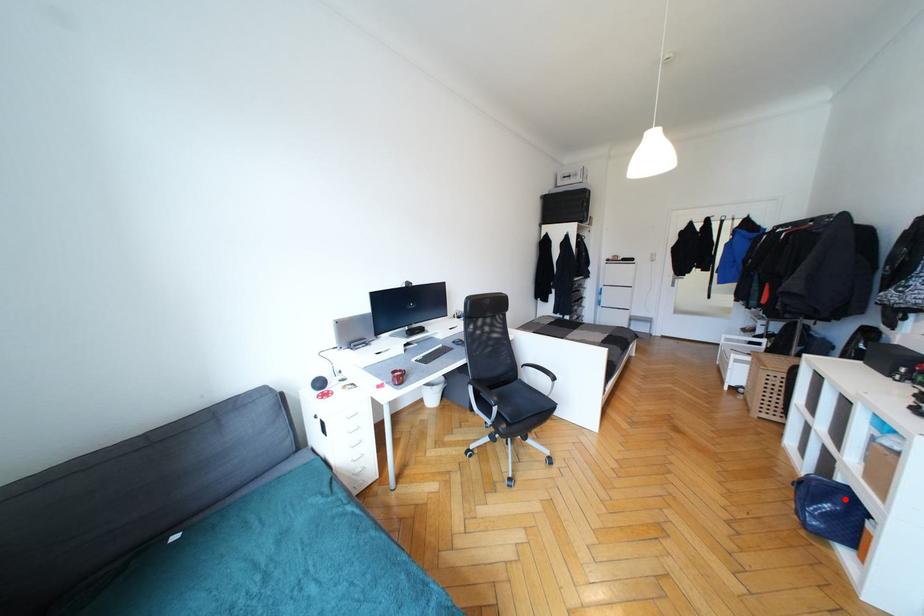
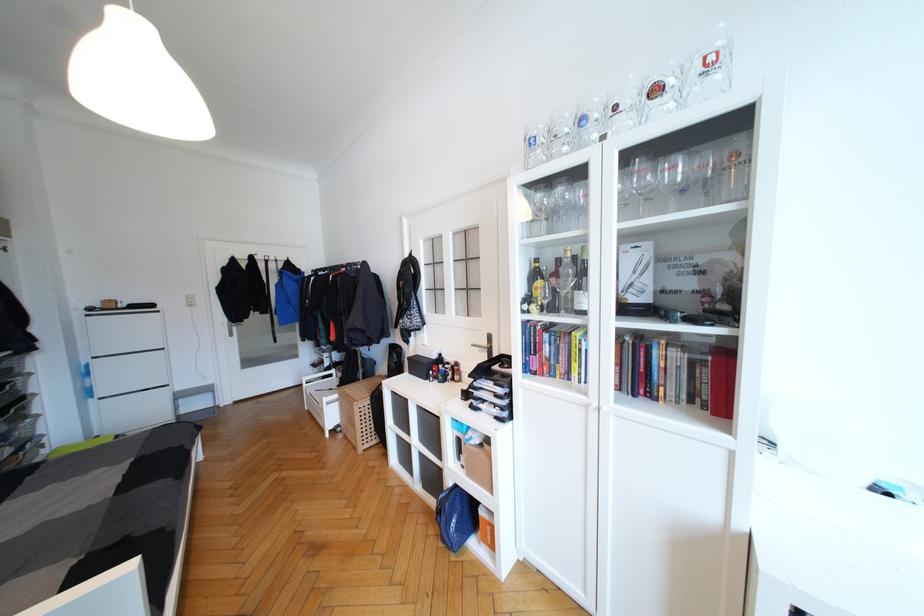
The point at the highlighted location is marked in the first image. Where is the corresponding point in the second image?

(460, 501)